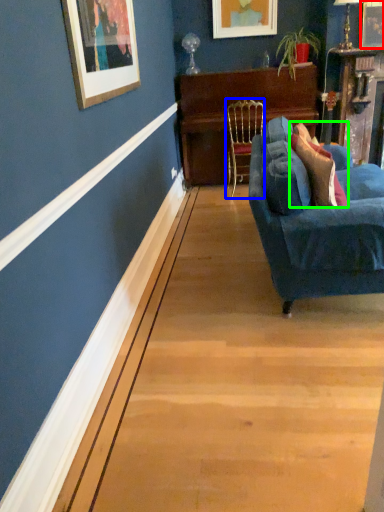
Question: Considering the real-world distances, which object is farthest from picture frame (highlighted by a red box)? chair (highlighted by a blue box) or pillow (highlighted by a green box)?

Choices:
 (A) chair
 (B) pillow

Answer: (B)